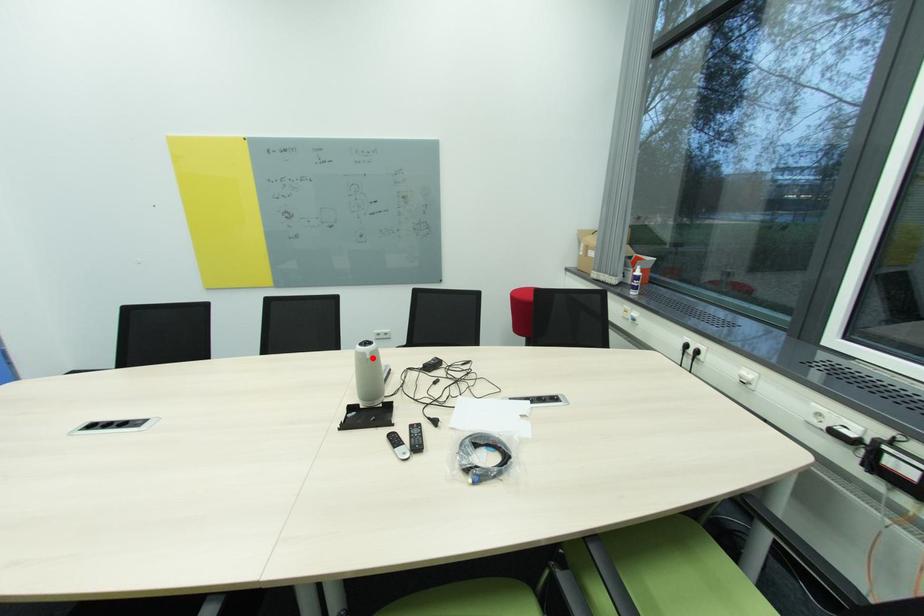
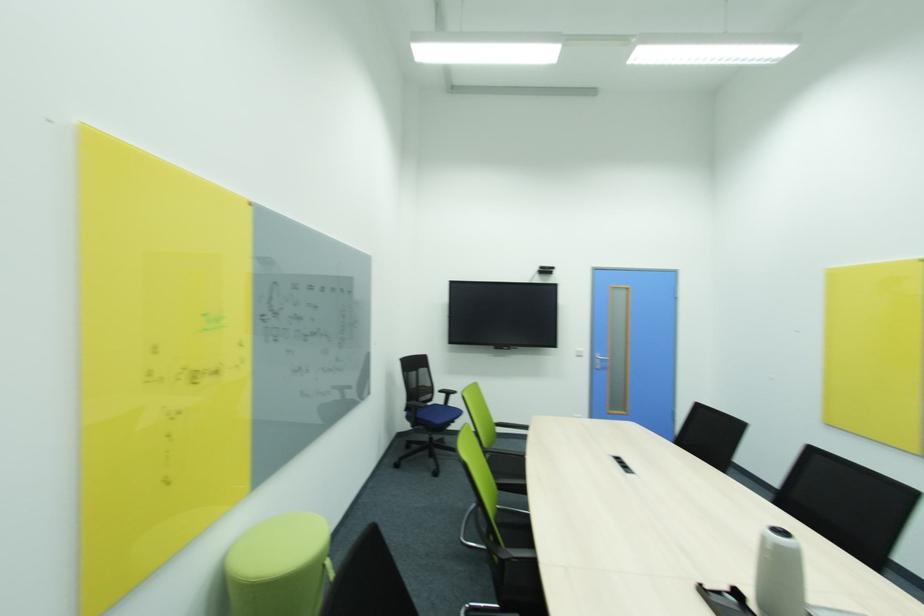
Question: A red point is marked in image1. In image2, is the corresponding 3D point closer to the camera or farther? Reply with the corresponding letter.

Choices:
 (A) The corresponding 3D point is closer.
 (B) The corresponding 3D point is farther.

Answer: (B)